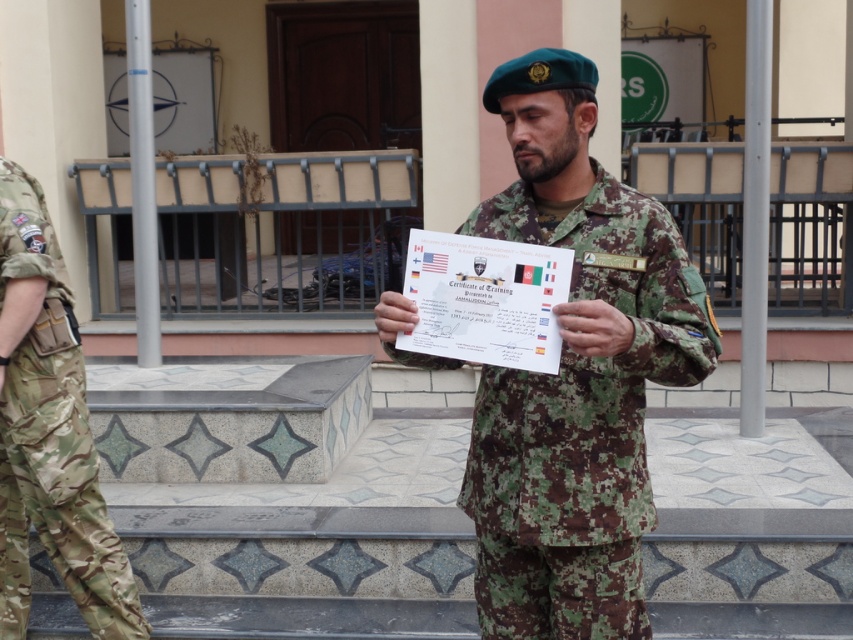
Does camouflage uniform at center have a greater height compared to camouflage fabric pants at left?

In fact, camouflage uniform at center may be shorter than camouflage fabric pants at left.

Between point (567, 248) and point (70, 419), which one is positioned in front?

Point (567, 248) is more forward.

At what (x,y) coordinates should I click in order to perform the action: click on camouflage uniform at center. Please return your answer as a coordinate pair (x, y). The height and width of the screenshot is (640, 853). Looking at the image, I should click on (575, 372).